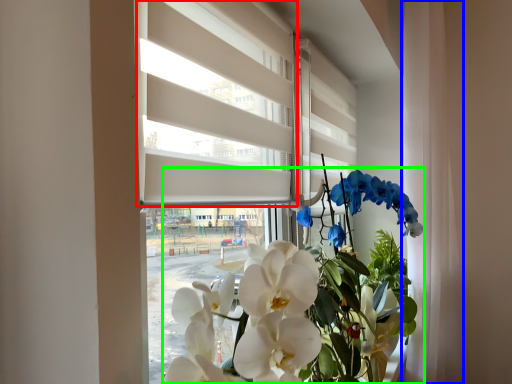
Question: Based on their relative distances, which object is farther from blind (highlighted by a red box)? Choose from curtain (highlighted by a blue box) and floral arrangement (highlighted by a green box).

Choices:
 (A) curtain
 (B) floral arrangement

Answer: (A)